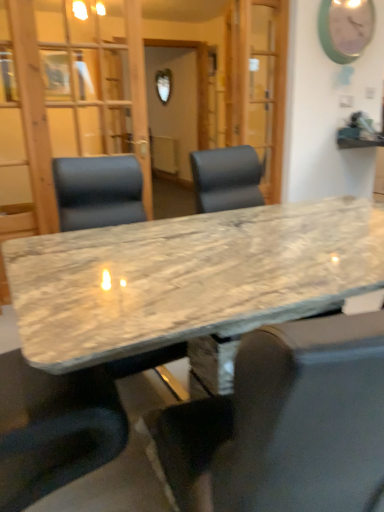
Question: From a real-world perspective, does marble table at center sit lower than leather-like black chair at center, the 1th chair positioned from the left?

Choices:
 (A) no
 (B) yes

Answer: (B)

Question: Is marble table at center oriented away from leather-like black chair at center, which is counted as the first chair, starting from the back?

Choices:
 (A) no
 (B) yes

Answer: (A)

Question: Are marble table at center and leather-like black chair at center, which is counted as the first chair, starting from the back, located far from each other?

Choices:
 (A) no
 (B) yes

Answer: (A)

Question: From the image's perspective, is marble table at center on leather-like black chair at center, acting as the second chair starting from the right?

Choices:
 (A) yes
 (B) no

Answer: (B)

Question: From the image's perspective, is marble table at center below leather-like black chair at center, acting as the second chair starting from the right?

Choices:
 (A) yes
 (B) no

Answer: (A)

Question: From the image's perspective, is marble table at center positioned above or below leather-like black chair at center, acting as the second chair starting from the right?

Choices:
 (A) above
 (B) below

Answer: (B)

Question: From a real-world perspective, is marble table at center positioned above or below leather-like black chair at center, arranged as the second chair when viewed from the front?

Choices:
 (A) above
 (B) below

Answer: (B)

Question: In the image, is marble table at center positioned in front of or behind leather-like black chair at center, which is counted as the first chair, starting from the back?

Choices:
 (A) behind
 (B) front

Answer: (B)

Question: Would you say marble table at center is inside or outside leather-like black chair at center, the 1th chair positioned from the left?

Choices:
 (A) outside
 (B) inside

Answer: (A)

Question: Is point (89, 51) closer or farther from the camera than point (367, 415)?

Choices:
 (A) farther
 (B) closer

Answer: (A)

Question: Looking at the image, does transparent glass door at center seem bigger or smaller compared to marble table at center, which appears as the 1th chair when viewed from the right?

Choices:
 (A) big
 (B) small

Answer: (A)

Question: Considering the positions of transparent glass door at center and marble table at center, the first chair viewed from the front, in the image, is transparent glass door at center taller or shorter than marble table at center, the first chair viewed from the front,?

Choices:
 (A) tall
 (B) short

Answer: (A)

Question: Choose the correct answer: Is transparent glass door at center inside marble table at center, the second chair viewed from the back, or outside it?

Choices:
 (A) outside
 (B) inside

Answer: (A)

Question: From the image's perspective, is matte green clock at upper right above or below marble table at center, the first chair viewed from the front?

Choices:
 (A) above
 (B) below

Answer: (A)

Question: Is matte green clock at upper right wider or thinner than marble table at center, the second chair viewed from the back?

Choices:
 (A) wide
 (B) thin

Answer: (B)